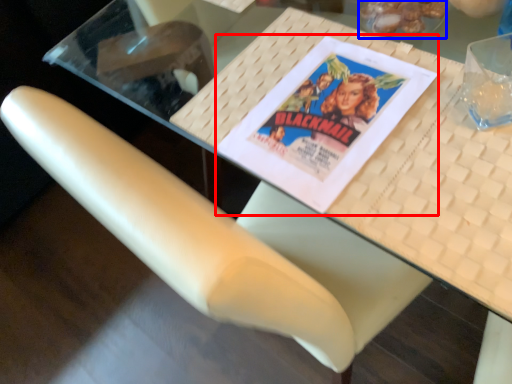
Question: Which point is further to the camera, paperback book (highlighted by a red box) or food (highlighted by a blue box)?

Choices:
 (A) paperback book
 (B) food

Answer: (B)